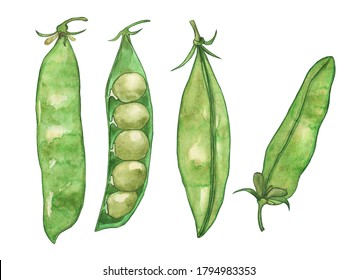
The image size is (358, 280). I want to click on art, so (131, 140).